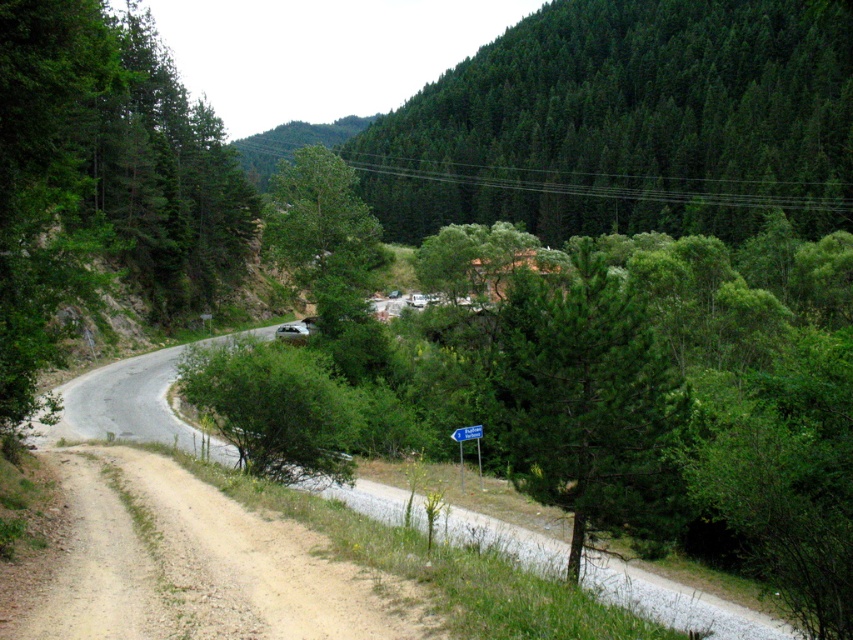
Question: Considering the relative positions of green textured forest at upper center and green leafy bush at center in the image provided, where is green textured forest at upper center located with respect to green leafy bush at center?

Choices:
 (A) above
 (B) below

Answer: (A)

Question: Which of the following is the closest to the observer?

Choices:
 (A) green matte tree at center
 (B) green leafy bush at center

Answer: (B)

Question: Which object appears closest to the camera in this image?

Choices:
 (A) green leafy bush at center
 (B) brown gravel dirt track at lower left
 (C) green leafy tree at left

Answer: (B)

Question: Does green matte tree at center appear on the right side of blue plastic sign at center?

Choices:
 (A) yes
 (B) no

Answer: (B)

Question: Is green matte tree at center to the right of blue plastic sign at center from the viewer's perspective?

Choices:
 (A) yes
 (B) no

Answer: (B)

Question: Estimate the real-world distances between objects in this image. Which object is farther from the green matte tree at center?

Choices:
 (A) green textured forest at upper center
 (B) brown gravel dirt track at lower left
 (C) green matte tree at center-right

Answer: (A)